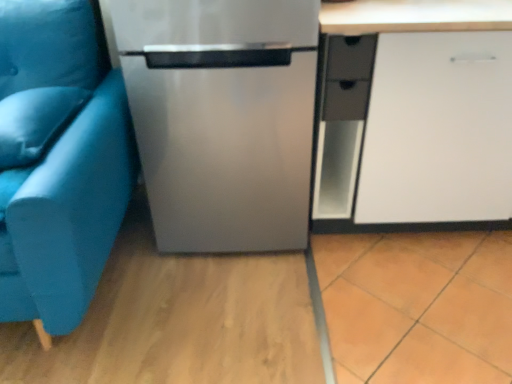
Question: Is white matte cabinet at right inside or outside of teal fabric studio couch at left?

Choices:
 (A) inside
 (B) outside

Answer: (B)

Question: Considering the positions of white matte cabinet at right and teal fabric studio couch at left in the image, is white matte cabinet at right wider or thinner than teal fabric studio couch at left?

Choices:
 (A) thin
 (B) wide

Answer: (A)

Question: Based on their relative distances, which object is farther from the stainless steel refrigerator at center?

Choices:
 (A) teal fabric studio couch at left
 (B) satin blue pillow at left
 (C) white matte cabinet at right
 (D) matte black drawer at center right

Answer: (B)

Question: Considering the real-world distances, which object is closest to the teal fabric studio couch at left?

Choices:
 (A) matte black drawer at center right
 (B) white matte cabinet at right
 (C) stainless steel refrigerator at center
 (D) satin blue pillow at left

Answer: (D)